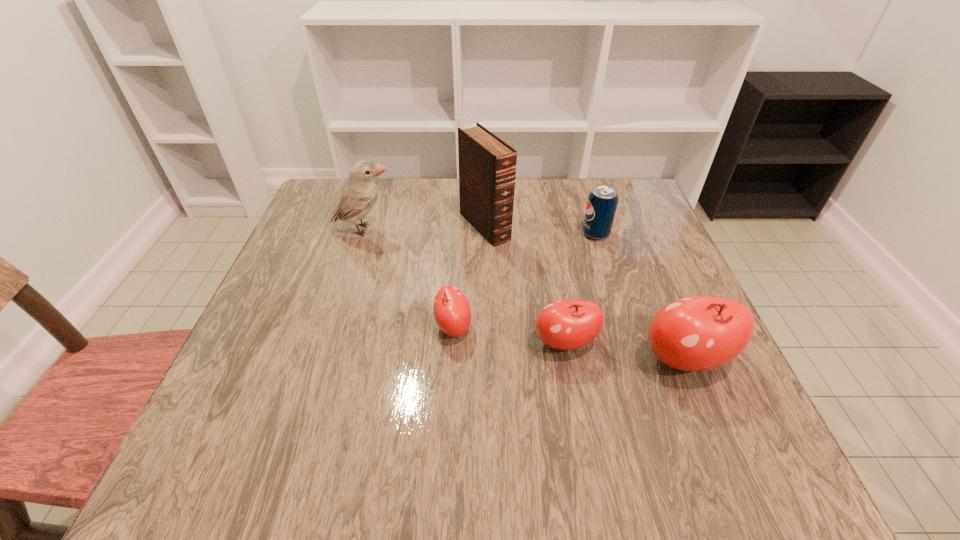
Identify the location of free location that satisfies the following two spatial constraints: 1. on the back side of the leftmost apple; 2. at the face of the bird. The image size is (960, 540). (459, 230).

I want to click on free location that satisfies the following two spatial constraints: 1. on the back side of the shortest object; 2. at the face of the bird, so click(x=459, y=230).